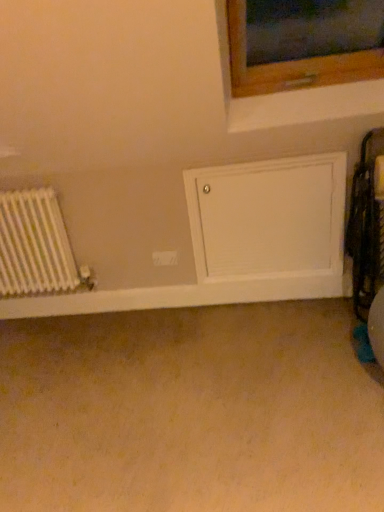
Where is `white matte door at lower center`? white matte door at lower center is located at coordinates (179, 296).

Describe the element at coordinates (34, 245) in the screenshot. I see `white metallic radiator at left` at that location.

Locate an element on the screen. The height and width of the screenshot is (512, 384). white matte door at lower center is located at coordinates (179, 296).

Is white matte door at center aimed at white matte door at lower center?

No, white matte door at center is not oriented towards white matte door at lower center.

Based on the photo, which is correct: white matte door at center is inside white matte door at lower center, or outside of it?

white matte door at center is spatially situated outside white matte door at lower center.

From the picture: Between white matte door at center and white matte door at lower center, which one appears on the left side from the viewer's perspective?

Positioned to the left is white matte door at lower center.

Considering the sizes of objects white matte door at center and white matte door at lower center in the image provided, who is taller, white matte door at center or white matte door at lower center?

white matte door at center.

From a real-world perspective, between white matte door at lower center and white metallic radiator at left, who is vertically higher?

white metallic radiator at left, from a real-world perspective.

From the image's perspective, is white matte door at lower center located beneath white metallic radiator at left?

Indeed, from the image's perspective, white matte door at lower center is shown beneath white metallic radiator at left.

Does point (344, 286) come behind point (17, 193)?

Yes, it is behind point (17, 193).

In the image, is white matte door at lower center positioned in front of or behind white matte door at center?

Clearly, white matte door at lower center is behind white matte door at center.

This screenshot has height=512, width=384. What are the coordinates of `wide on the right of white matte door at lower center` in the screenshot? It's located at (268, 218).

Does white matte door at lower center have a smaller size compared to white matte door at center?

Correct, white matte door at lower center occupies less space than white matte door at center.

Is white matte door at lower center spatially inside white matte door at center, or outside of it?

The correct answer is: outside.

Is white plastic electric outlet at center at the right side of white matte door at center?

Incorrect, white plastic electric outlet at center is not on the right side of white matte door at center.

Considering the sizes of objects white plastic electric outlet at center and white matte door at center in the image provided, who is thinner, white plastic electric outlet at center or white matte door at center?

With smaller width is white plastic electric outlet at center.

Is white plastic electric outlet at center next to white matte door at center?

They are not placed beside each other.

Looking at this image, which is correct: white plastic electric outlet at center is inside white matte door at center, or outside of it?

white plastic electric outlet at center is outside white matte door at center.

Where is `radiator positioned vertically above the white plastic electric outlet at center (from a real-world perspective)`? radiator positioned vertically above the white plastic electric outlet at center (from a real-world perspective) is located at coordinates click(x=34, y=245).

Is white metallic radiator at left next to white plastic electric outlet at center and touching it?

No.

Considering the sizes of objects white metallic radiator at left and white plastic electric outlet at center in the image provided, who is bigger, white metallic radiator at left or white plastic electric outlet at center?

With larger size is white metallic radiator at left.

Could you tell me if white matte door at center is turned towards white metallic radiator at left?

No, white matte door at center is not oriented towards white metallic radiator at left.

Is white matte door at center smaller than white metallic radiator at left?

Yes.

Can you confirm if white matte door at center is wider than white metallic radiator at left?

No, white matte door at center is not wider than white metallic radiator at left.

Is white matte door at center to the right of white metallic radiator at left from the viewer's perspective?

Correct, you'll find white matte door at center to the right of white metallic radiator at left.

Is white plastic electric outlet at center inside or outside of white metallic radiator at left?

white plastic electric outlet at center is outside white metallic radiator at left.

Is point (171, 255) positioned in front of point (30, 276)?

No.

Considering the positions of objects white plastic electric outlet at center and white metallic radiator at left in the image provided, who is more to the left, white plastic electric outlet at center or white metallic radiator at left?

Positioned to the left is white metallic radiator at left.

From the image's perspective, is white plastic electric outlet at center positioned above or below white metallic radiator at left?

Based on their image positions, white plastic electric outlet at center is located beneath white metallic radiator at left.

Where is `window sill below the white matte door at center (from a real-world perspective)`? The image size is (384, 512). window sill below the white matte door at center (from a real-world perspective) is located at coordinates (179, 296).

Locate an element on the screen. This screenshot has width=384, height=512. radiator on the left of white matte door at lower center is located at coordinates (34, 245).

Based on the photo, looking at the image, which one is located further to white metallic radiator at left, white matte door at center or white matte door at lower center?

Based on the image, white matte door at center appears to be further to white metallic radiator at left.

Which object lies further to the anchor point white plastic electric outlet at center, white matte door at lower center or white matte door at center?

Among the two, white matte door at center is located further to white plastic electric outlet at center.

Considering their positions, is white matte door at lower center positioned further to white matte door at center than white metallic radiator at left?

white metallic radiator at left is positioned further to the anchor white matte door at center.

In the scene shown: Based on their spatial positions, is white matte door at center or white metallic radiator at left further from white plastic electric outlet at center?

Based on the image, white metallic radiator at left appears to be further to white plastic electric outlet at center.

Looking at the image, which one is located further to white metallic radiator at left, white matte door at lower center or white matte door at center?

white matte door at center is positioned further to the anchor white metallic radiator at left.

Based on the photo, when comparing their distances from white matte door at lower center, does white metallic radiator at left or white matte door at center seem further?

Among the two, white metallic radiator at left is located further to white matte door at lower center.

Estimate the real-world distances between objects in this image. Which object is closer to white matte door at lower center, white metallic radiator at left or white plastic electric outlet at center?

The object closer to white matte door at lower center is white plastic electric outlet at center.

When comparing their distances from white matte door at center, does white plastic electric outlet at center or white metallic radiator at left seem further?

Based on the image, white metallic radiator at left appears to be further to white matte door at center.

This screenshot has width=384, height=512. What are the coordinates of `window sill between white metallic radiator at left and white matte door at center` in the screenshot? It's located at (179, 296).

Identify the location of window sill located between white plastic electric outlet at center and white matte door at center in the left-right direction. (179, 296).

Locate an element on the screen. This screenshot has width=384, height=512. electric outlet located between white metallic radiator at left and white matte door at lower center in the left-right direction is located at coordinates (165, 258).

This screenshot has height=512, width=384. What are the coordinates of `electric outlet located between white metallic radiator at left and white matte door at center in the left-right direction` in the screenshot? It's located at (165, 258).